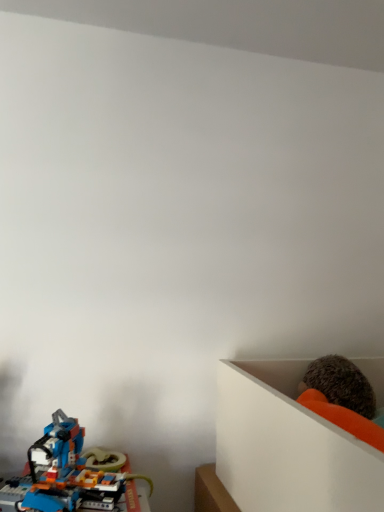
You are a GUI agent. You are given a task and a screenshot of the screen. Output one action in this format:
    pyautogui.click(x=<x>, y=<y>)
    Task: Click on the translucent plastic toy at lower left
    The width and height of the screenshot is (384, 512).
    Given the screenshot: What is the action you would take?
    pyautogui.click(x=70, y=476)

What is the approximate width of translucent plastic toy at lower left?

translucent plastic toy at lower left is 6.54 inches in width.

What do you see at coordinates (70, 476) in the screenshot? I see `translucent plastic toy at lower left` at bounding box center [70, 476].

Identify the location of translucent plastic toy at lower left. Image resolution: width=384 pixels, height=512 pixels. (70, 476).